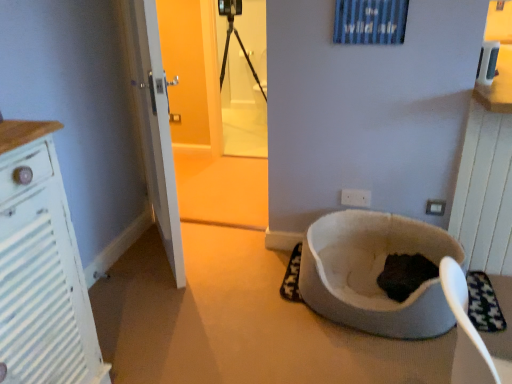
Identify the location of vacant space to the left of white plastic electric outlet at lower right, placed as the 2th electric outlet when sorted from left to right. (406, 208).